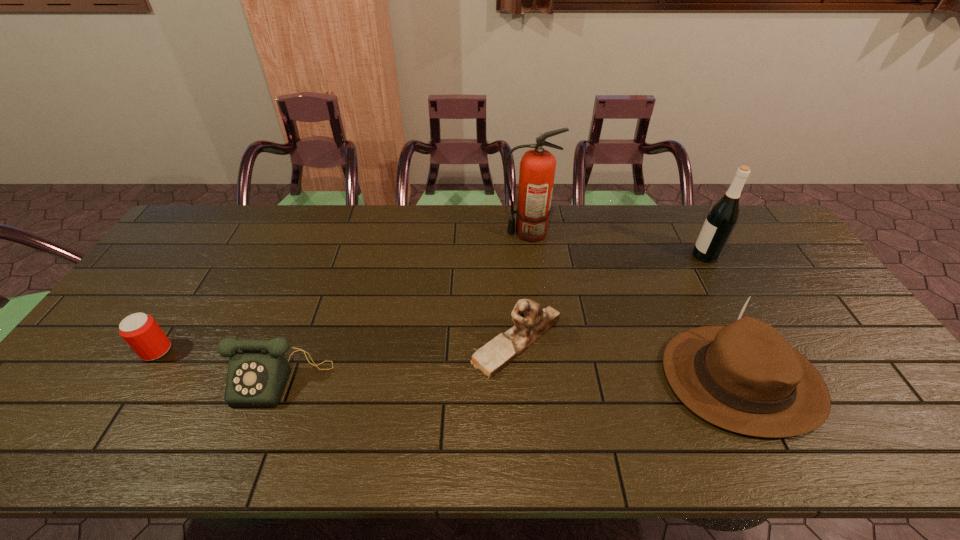
This screenshot has width=960, height=540. Identify the location of free point between the fourth shortest object and the second farthest object. (724, 317).

You are a GUI agent. You are given a task and a screenshot of the screen. Output one action in this format:
    pyautogui.click(x=<x>, y=<y>)
    Task: Click on the third closest object to the beer can
    This screenshot has width=960, height=540.
    Given the screenshot: What is the action you would take?
    pyautogui.click(x=537, y=167)

Where is `object that is the third closest one to the leftmost object`? The width and height of the screenshot is (960, 540). object that is the third closest one to the leftmost object is located at coordinates (537, 167).

The width and height of the screenshot is (960, 540). Find the location of `free space in the image that satisfies the following two spatial constraints: 1. on the front-facing side of the figurine; 2. on the front side of the leftmost object`. free space in the image that satisfies the following two spatial constraints: 1. on the front-facing side of the figurine; 2. on the front side of the leftmost object is located at coordinates (516, 350).

Where is `free location that satisfies the following two spatial constraints: 1. on the label of the second farthest object; 2. on the dial of the second object from left to right`? free location that satisfies the following two spatial constraints: 1. on the label of the second farthest object; 2. on the dial of the second object from left to right is located at coordinates (774, 378).